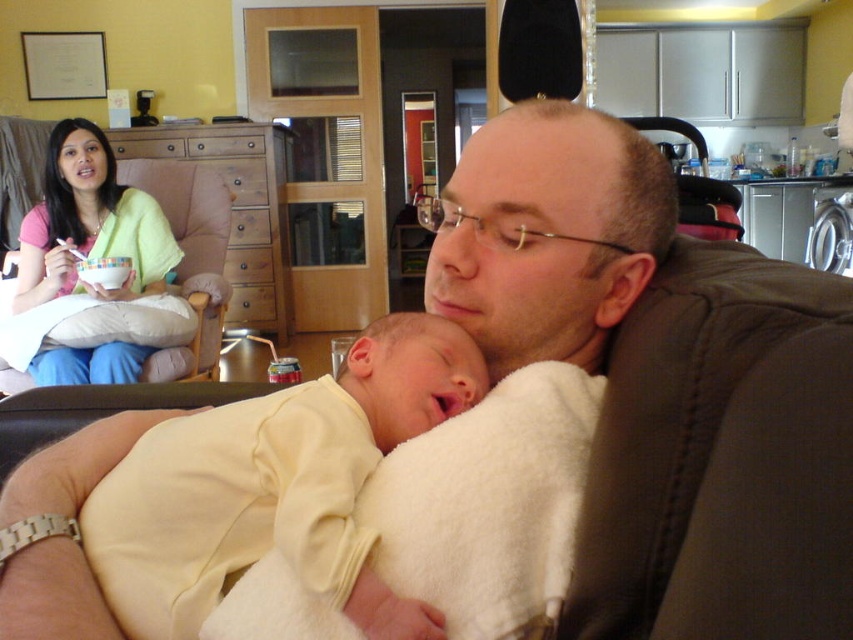
You are a photographer trying to capture a closeup of the soft yellow onesie at center. The camera is 61.07 centimeters away. Is the camera close enough to focus on the onesie?

The camera is 61.07 centimeters away from the soft yellow onesie at center, so yes, the camera is close enough to focus on the onesie.

You are a photographer trying to capture a closeup of the baby in the scene. The soft yellow onesie at center and the pink fabric shirt at upper left are both in the frame. Which clothing item should you focus on to ensure the baby is the main subject?

The soft yellow onesie at center should be focused on because it occupies less space than the pink fabric shirt at upper left, making it more likely to highlight the baby as the main subject.

You are a photographer taking a picture of the soft yellow onesie at center and the pink fabric shirt at upper left. Which object should you focus on first if you want to capture both in the same frame without moving the camera?

The soft yellow onesie at center is positioned under the pink fabric shirt at upper left, so you should focus on the pink fabric shirt at upper left first to ensure both are in the frame without moving the camera.